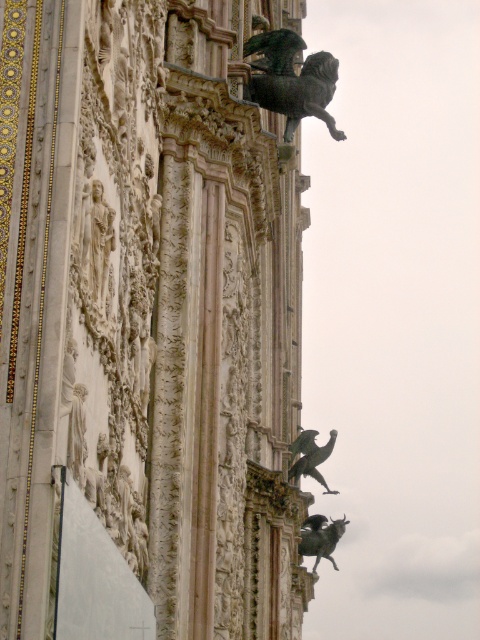
Question: Which point appears closest to the camera in this image?

Choices:
 (A) (264, 45)
 (B) (312, 456)
 (C) (336, 568)

Answer: (A)

Question: Which object is farther from the camera taking this photo?

Choices:
 (A) bronze/golden lion at upper center
 (B) shiny bronze gargoyle at upper right
 (C) shiny bronze bird at upper center

Answer: (B)

Question: Is shiny bronze gargoyle at upper right bigger than shiny bronze bird at upper center?

Choices:
 (A) no
 (B) yes

Answer: (A)

Question: Which of the following is the farthest from the observer?

Choices:
 (A) bronze/golden lion at upper center
 (B) shiny bronze gargoyle at upper right

Answer: (B)

Question: In this image, where is shiny bronze gargoyle at upper right located relative to shiny bronze bird at upper center?

Choices:
 (A) left
 (B) right

Answer: (B)

Question: Is shiny bronze gargoyle at upper right to the left of shiny bronze bird at upper center from the viewer's perspective?

Choices:
 (A) no
 (B) yes

Answer: (A)